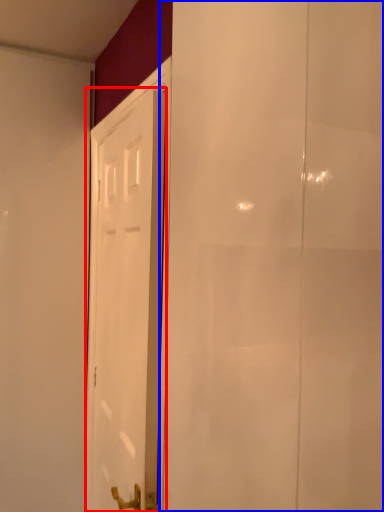
Question: Which object is closer to the camera taking this photo, door (highlighted by a red box) or screen door (highlighted by a blue box)?

Choices:
 (A) door
 (B) screen door

Answer: (B)